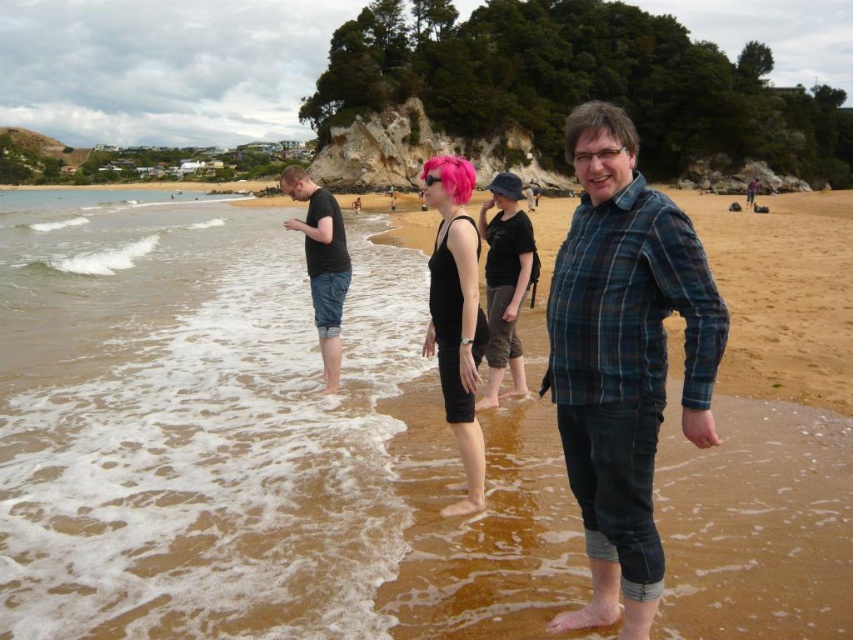
You are a photographer trying to capture a group photo of the two people at the coordinates point (579, 129) and point (328, 372). Based on their positions, which person should you position closer to the camera to ensure both are in focus?

Point (579, 129) is in front of point (328, 372), so you should position the person at point (328, 372) closer to the camera to ensure both are in focus.

You are a photographer trying to capture the scene from the shore. You notice the plaid flannel shirt at center and the pink matte hair at center. Which one is positioned lower in the frame?

The plaid flannel shirt at center is positioned lower in the frame than the pink matte hair at center.